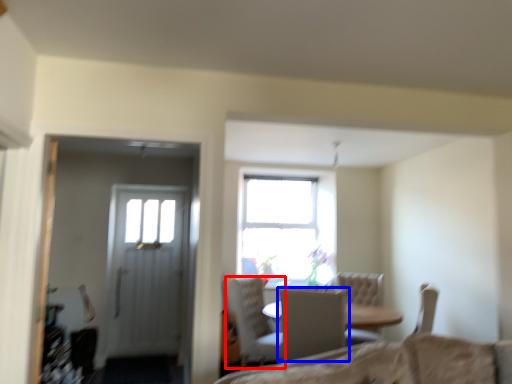
Question: Which of the following is the closest to the observer, chair (highlighted by a red box) or chair (highlighted by a blue box)?

Choices:
 (A) chair
 (B) chair

Answer: (B)